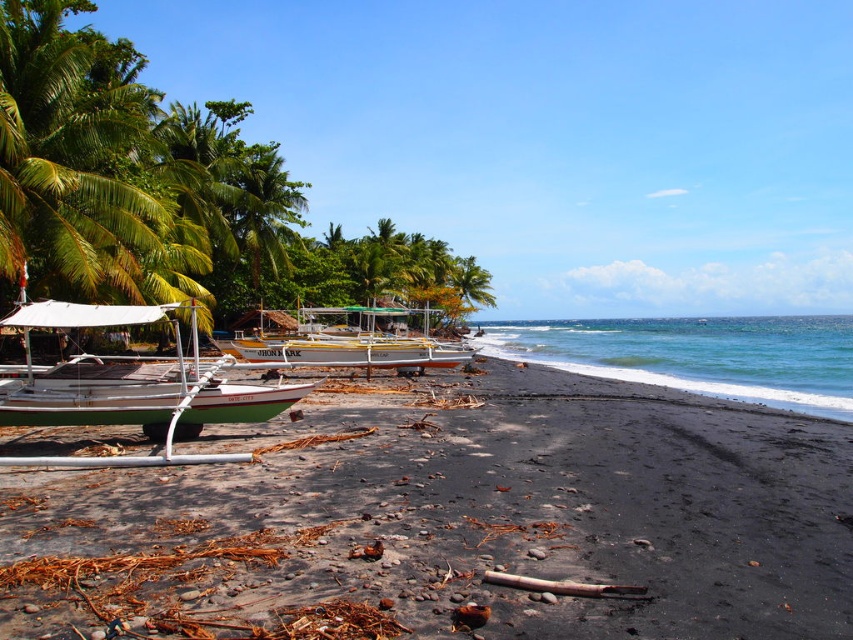
Question: Which object appears farthest from the camera in this image?

Choices:
 (A) blue-green water at lower right
 (B) black sand at lower left

Answer: (A)

Question: Does black sand at lower left have a larger size compared to white wood boat at center?

Choices:
 (A) no
 (B) yes

Answer: (A)

Question: Which of the following is the farthest from the observer?

Choices:
 (A) (848, 396)
 (B) (368, 326)
 (C) (177, 348)
 (D) (457, 314)

Answer: (D)

Question: Is white wood boat at center thinner than green leafy palm tree at center?

Choices:
 (A) yes
 (B) no

Answer: (B)

Question: Which point is closer to the camera?

Choices:
 (A) (461, 280)
 (B) (402, 362)
 (C) (67, 308)

Answer: (C)

Question: In this image, where is white wood boat at center located relative to green leafy palm tree at center?

Choices:
 (A) left
 (B) right

Answer: (A)